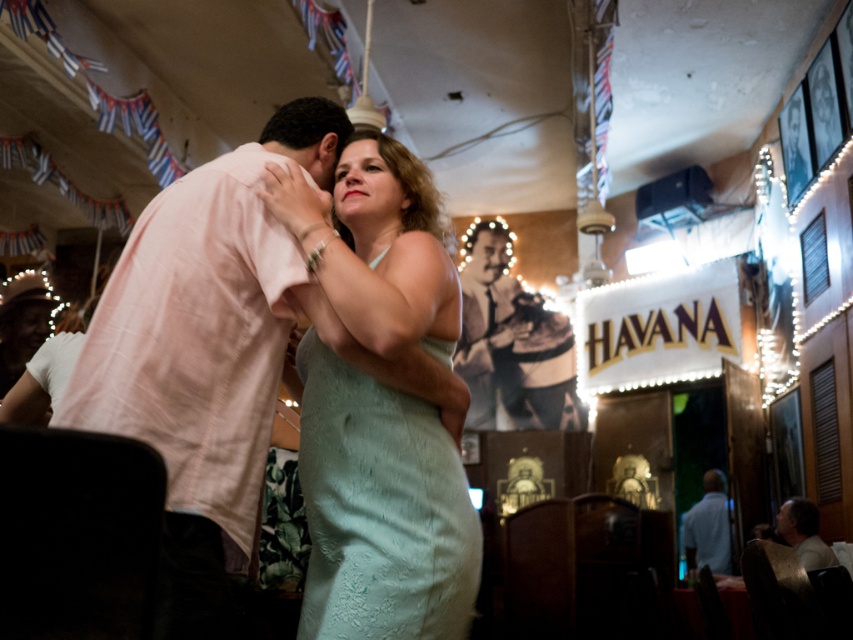
Is white shirt at lower right further to the viewer compared to light brown leather jacket at lower right?

Yes, white shirt at lower right is further from the viewer.

Does point (717, 538) lie in front of point (788, 515)?

No, (717, 538) is behind (788, 515).

Between point (693, 516) and point (820, 541), which one is positioned in front?

Point (820, 541)

Locate an element on the screen. Image resolution: width=853 pixels, height=640 pixels. white shirt at lower right is located at coordinates (708, 525).

Can you confirm if light pink cotton shirt at center is wider than light brown leather jacket at lower right?

Correct, the width of light pink cotton shirt at center exceeds that of light brown leather jacket at lower right.

Does light pink cotton shirt at center have a lesser height compared to light brown leather jacket at lower right?

Incorrect, light pink cotton shirt at center's height does not fall short of light brown leather jacket at lower right's.

Does point (351, 340) lie in front of point (813, 516)?

Yes, point (351, 340) is closer to viewer.

Locate an element on the screen. This screenshot has height=640, width=853. light pink cotton shirt at center is located at coordinates (215, 356).

Can you confirm if light pink cotton shirt at center is positioned to the right of mint lace dress at center?

No, light pink cotton shirt at center is not to the right of mint lace dress at center.

Does light pink cotton shirt at center lie behind mint lace dress at center?

That is False.

Identify the location of light pink cotton shirt at center. pos(215,356).